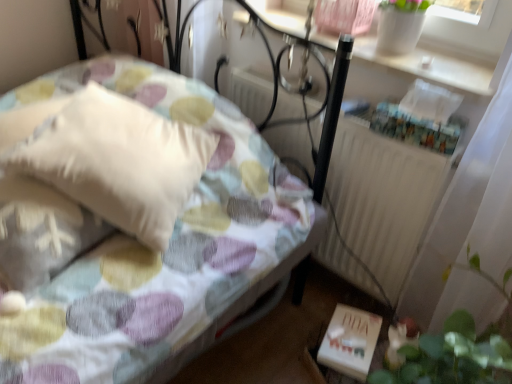
Question: Which is correct: white textured radiator at center is inside white matte book at lower right, or outside of it?

Choices:
 (A) inside
 (B) outside

Answer: (B)

Question: Is white textured radiator at center bigger or smaller than white matte book at lower right?

Choices:
 (A) big
 (B) small

Answer: (A)

Question: Which is nearer to the white matte book at lower right?

Choices:
 (A) green leafy plant at lower right
 (B) fluffy white pillow at upper left
 (C) white soft pillow at left
 (D) white textured radiator at center
 (E) white ceramic vase at upper right

Answer: (A)

Question: Which of these objects is positioned closest to the green leafy plant at lower right?

Choices:
 (A) white textured radiator at center
 (B) white ceramic vase at upper right
 (C) white matte book at lower right
 (D) fluffy white pillow at upper left
 (E) white soft pillow at left

Answer: (C)